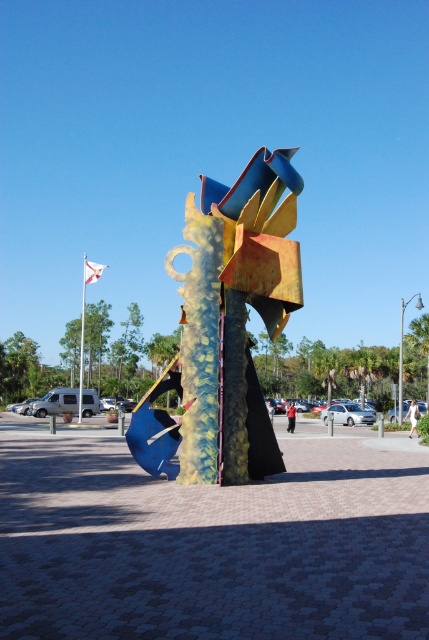
This screenshot has height=640, width=429. In order to click on white flagpole at upper left in this screenshot , I will do (x=82, y=337).

Which is above, white flagpole at upper left or metallic pole at center?

Positioned higher is white flagpole at upper left.

Locate an element on the screen. Image resolution: width=429 pixels, height=640 pixels. white flagpole at upper left is located at coordinates (82, 337).

Can you confirm if metallic blue and yellow abstract sculpture at center is thinner than white flagpole at upper left?

Yes, metallic blue and yellow abstract sculpture at center is thinner than white flagpole at upper left.

Between metallic blue and yellow abstract sculpture at center and white flagpole at upper left, which one has more height?

white flagpole at upper left

Identify the location of metallic blue and yellow abstract sculpture at center. (226, 326).

You are a GUI agent. You are given a task and a screenshot of the screen. Output one action in this format:
    pyautogui.click(x=<x>, y=<y>)
    Task: Click on the metallic blue and yellow abstract sculpture at center
    
    Given the screenshot: What is the action you would take?
    pyautogui.click(x=226, y=326)

Which is above, metallic blue and yellow abstract sculpture at center or metallic pole at center?

metallic pole at center

Is metallic blue and yellow abstract sculpture at center bigger than metallic pole at center?

Incorrect, metallic blue and yellow abstract sculpture at center is not larger than metallic pole at center.

Where is `metallic blue and yellow abstract sculpture at center`? metallic blue and yellow abstract sculpture at center is located at coordinates (226, 326).